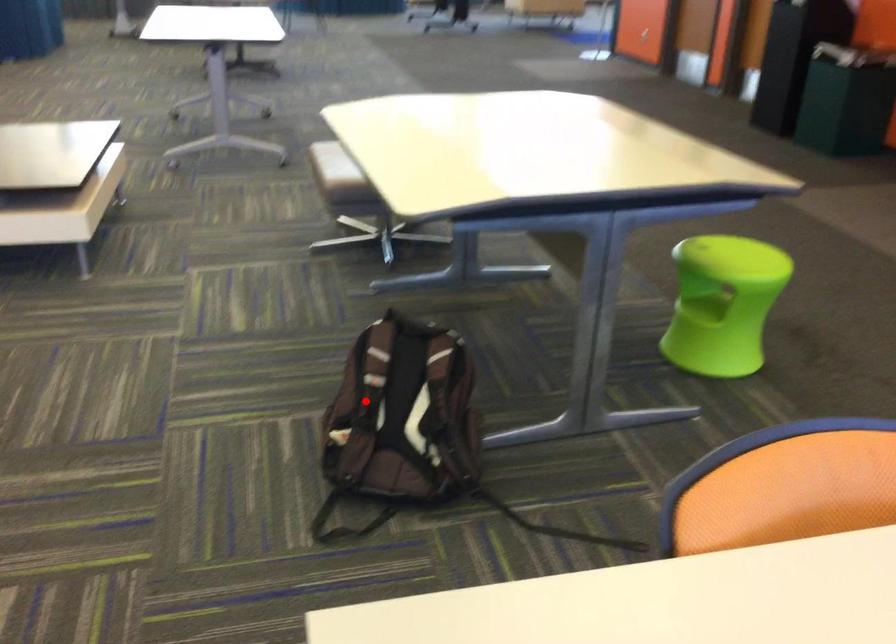
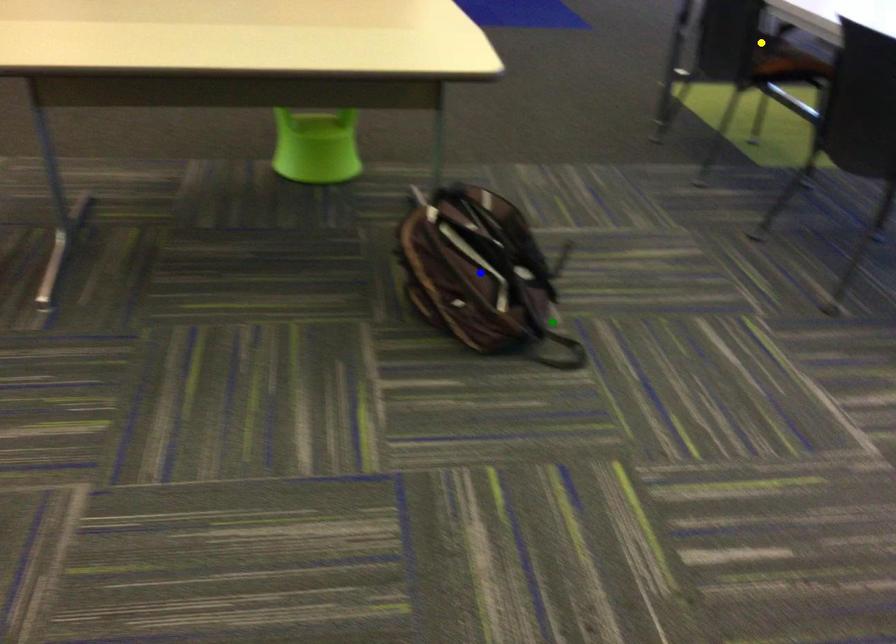
Question: I am providing you with two images of the same scene from different viewpoints. A red point is marked on the first image. You are given multiple points on the second image. Which point in image 2 represents the same 3d spot as the red point in image 1?

Choices:
 (A) blue point
 (B) yellow point
 (C) green point

Answer: (A)